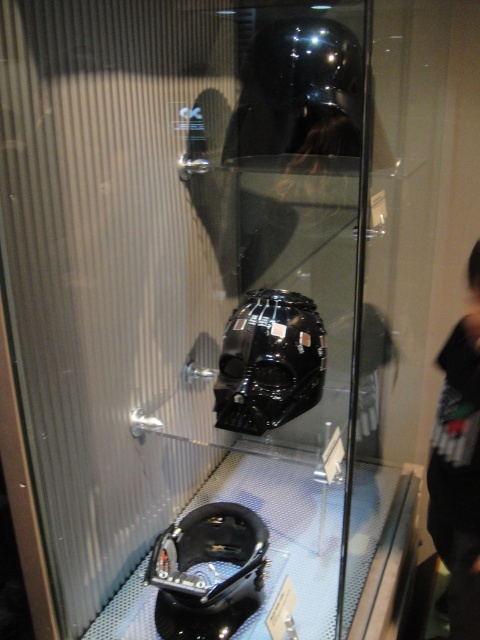
Between point (231, 344) and point (229, 547), which one is positioned behind?

Positioned behind is point (229, 547).

Is glossy black helmet at center wider than black matte helmet at lower center?

In fact, glossy black helmet at center might be narrower than black matte helmet at lower center.

Locate an element on the screen. The height and width of the screenshot is (640, 480). glossy black helmet at center is located at coordinates (269, 362).

Is glossy black helmet at upper center taller than black matte helmet at lower center?

Indeed, glossy black helmet at upper center has a greater height compared to black matte helmet at lower center.

Based on the photo, does glossy black helmet at upper center have a smaller size compared to black matte helmet at lower center?

No, glossy black helmet at upper center is not smaller than black matte helmet at lower center.

Which is in front, point (300, 51) or point (215, 552)?

Point (300, 51)

At what (x,y) coordinates should I click in order to perform the action: click on glossy black helmet at upper center. Please return your answer as a coordinate pair (x, y). The width and height of the screenshot is (480, 640). Looking at the image, I should click on (299, 92).

Is glossy black helmet at upper center behind glossy black helmet at center?

Yes, it is.

Is glossy black helmet at upper center to the left of glossy black helmet at center from the viewer's perspective?

In fact, glossy black helmet at upper center is to the right of glossy black helmet at center.

Between point (342, 122) and point (279, 312), which one is positioned behind?

Point (279, 312)

I want to click on glossy black helmet at upper center, so click(x=299, y=92).